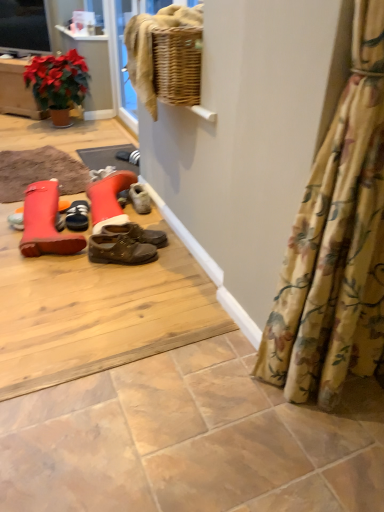
Question: Is black suede shoes at center, acting as the second footwear starting from the front, not near leather boot at left, which is the 1th footwear from front to back?

Choices:
 (A) no
 (B) yes

Answer: (A)

Question: Can you confirm if black suede shoes at center, which is the 1th footwear in back-to-front order, is wider than leather boot at left, acting as the 2th footwear starting from the back?

Choices:
 (A) no
 (B) yes

Answer: (A)

Question: Considering the relative sizes of black suede shoes at center, which is the 1th footwear in back-to-front order, and leather boot at left, which is the 1th footwear from front to back, in the image provided, is black suede shoes at center, which is the 1th footwear in back-to-front order, smaller than leather boot at left, which is the 1th footwear from front to back,?

Choices:
 (A) no
 (B) yes

Answer: (B)

Question: Considering the relative sizes of black suede shoes at center, which is the 1th footwear in back-to-front order, and leather boot at left, acting as the 2th footwear starting from the back, in the image provided, is black suede shoes at center, which is the 1th footwear in back-to-front order, bigger than leather boot at left, acting as the 2th footwear starting from the back,?

Choices:
 (A) yes
 (B) no

Answer: (B)

Question: Is black suede shoes at center, which is the 1th footwear in back-to-front order, further to the viewer compared to leather boot at left, which is the 1th footwear from front to back?

Choices:
 (A) no
 (B) yes

Answer: (B)

Question: Would you say black suede shoes at center, which is the 1th footwear in back-to-front order, is outside leather boot at left, acting as the 2th footwear starting from the back?

Choices:
 (A) yes
 (B) no

Answer: (B)

Question: Does black suede shoes at center, acting as the second footwear starting from the front, contain floral fabric curtain at lower right?

Choices:
 (A) no
 (B) yes

Answer: (A)

Question: Is black suede shoes at center, acting as the second footwear starting from the front, facing towards floral fabric curtain at lower right?

Choices:
 (A) yes
 (B) no

Answer: (B)

Question: Does black suede shoes at center, which is the 1th footwear in back-to-front order, have a greater height compared to floral fabric curtain at lower right?

Choices:
 (A) yes
 (B) no

Answer: (B)

Question: Is the depth of black suede shoes at center, acting as the second footwear starting from the front, greater than that of floral fabric curtain at lower right?

Choices:
 (A) yes
 (B) no

Answer: (A)

Question: Are black suede shoes at center, which is the 1th footwear in back-to-front order, and floral fabric curtain at lower right located far from each other?

Choices:
 (A) yes
 (B) no

Answer: (A)

Question: Is black suede shoes at center, acting as the second footwear starting from the front, shorter than floral fabric curtain at lower right?

Choices:
 (A) no
 (B) yes

Answer: (B)

Question: Is matte black television at upper left to the left of leather boot at left, which is the 1th footwear from front to back, from the viewer's perspective?

Choices:
 (A) no
 (B) yes

Answer: (B)